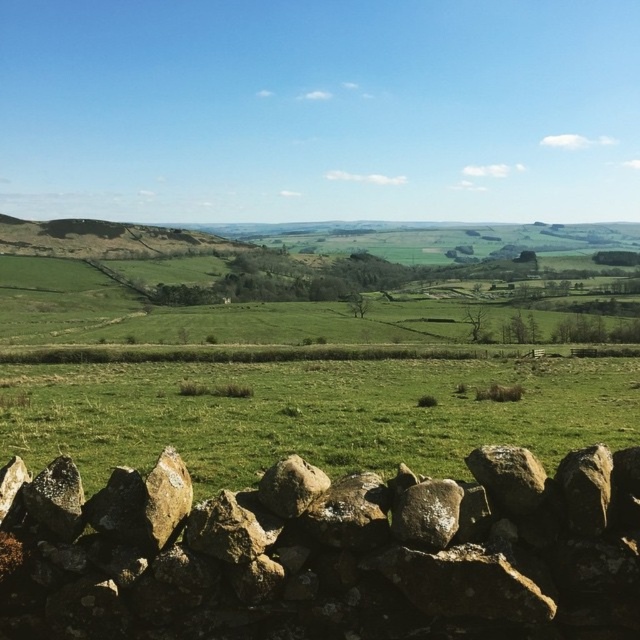
Is point (474, 588) farther from viewer compared to point (76, 451)?

No.

Can you confirm if brown rough stone at lower center is shorter than green grassy field at center?

Indeed, brown rough stone at lower center has a lesser height compared to green grassy field at center.

This screenshot has height=640, width=640. What are the coordinates of `brown rough stone at lower center` in the screenshot? It's located at (326, 554).

Is point (381, 454) positioned in front of point (305, 486)?

No, (381, 454) is behind (305, 486).

Is point (70, 378) farther from viewer compared to point (296, 508)?

That is True.

Locate an element on the screen. green grassy field at center is located at coordinates (310, 413).

Can you confirm if brown rough stone at lower center is positioned below rusty metallic rock at center?

Indeed, brown rough stone at lower center is positioned under rusty metallic rock at center.

Does point (186, 522) lie behind point (259, 486)?

No, (186, 522) is closer to viewer.

Is point (536, 605) farther from camera compared to point (310, 483)?

No, (536, 605) is closer to viewer.

The image size is (640, 640). Find the location of `brown rough stone at lower center`. brown rough stone at lower center is located at coordinates (326, 554).